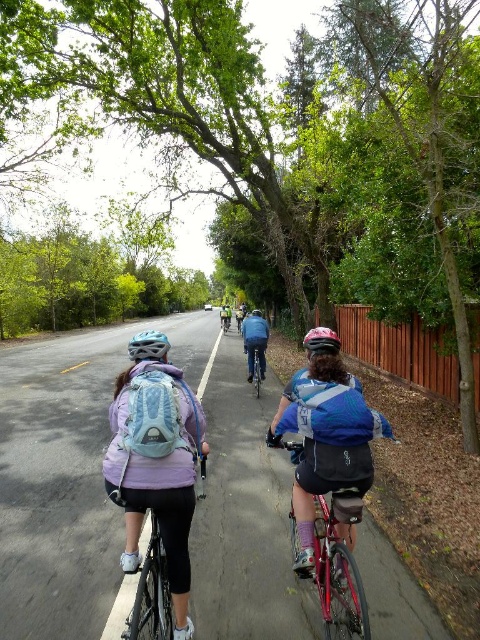
Is blue denim jacket at center taller than shiny blue helmet at center?

No, blue denim jacket at center is not taller than shiny blue helmet at center.

Who is taller, blue denim jacket at center or shiny blue helmet at center?

shiny blue helmet at center

This screenshot has height=640, width=480. Find the location of `blue denim jacket at center`. blue denim jacket at center is located at coordinates (254, 340).

Is matte blue backpack at left smaller than shiny red bicycle at center?

Actually, matte blue backpack at left might be larger than shiny red bicycle at center.

Between point (168, 548) and point (350, 500), which one is positioned in front?

Point (168, 548) is more forward.

Is point (123, 442) closer to camera compared to point (297, 442)?

Yes, it is.

Identify the location of matte blue backpack at left. The height and width of the screenshot is (640, 480). (156, 467).

Between blue fabric jacket at center and white matte bicycle helmet at center, which one is positioned lower?

blue fabric jacket at center is lower down.

Which of these two, blue fabric jacket at center or white matte bicycle helmet at center, stands taller?

blue fabric jacket at center is taller.

Between point (339, 401) and point (158, 355), which one is positioned behind?

The point (158, 355) is behind.

I want to click on blue fabric jacket at center, so click(x=325, y=440).